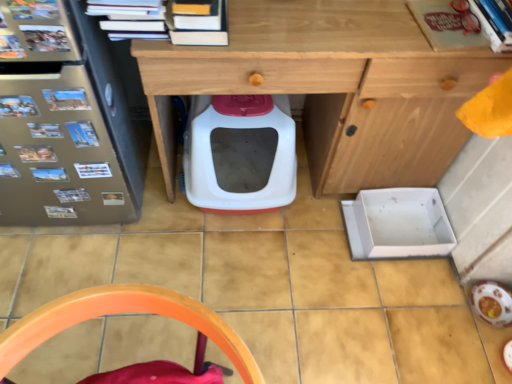
Question: From a real-world perspective, is matte red book at upper right, which is the 2th book from right to left, beneath wooden desk at center?

Choices:
 (A) no
 (B) yes

Answer: (A)

Question: Is matte red book at upper right, which is the 2th book from right to left, further to camera compared to wooden desk at center?

Choices:
 (A) no
 (B) yes

Answer: (B)

Question: From the image's perspective, does matte red book at upper right, which appears as the 2th book when viewed from the left, appear lower than wooden desk at center?

Choices:
 (A) no
 (B) yes

Answer: (A)

Question: Can you confirm if matte red book at upper right, which is the 2th book from right to left, is bigger than wooden desk at center?

Choices:
 (A) yes
 (B) no

Answer: (B)

Question: From a real-world perspective, is matte red book at upper right, which is the 2th book from right to left, on wooden desk at center?

Choices:
 (A) no
 (B) yes

Answer: (B)

Question: In terms of width, does hardcover book at upper right, the 1th book viewed from the right, look wider or thinner when compared to matte red book at upper right, which appears as the 2th book when viewed from the left?

Choices:
 (A) wide
 (B) thin

Answer: (A)

Question: From a real-world perspective, is hardcover book at upper right, the 1th book viewed from the right, positioned above or below matte red book at upper right, which appears as the 2th book when viewed from the left?

Choices:
 (A) above
 (B) below

Answer: (A)

Question: Considering the positions of hardcover book at upper right, the 1th book viewed from the right, and matte red book at upper right, which appears as the 2th book when viewed from the left, in the image, is hardcover book at upper right, the 1th book viewed from the right, bigger or smaller than matte red book at upper right, which appears as the 2th book when viewed from the left,?

Choices:
 (A) small
 (B) big

Answer: (B)

Question: Would you say hardcover book at upper right, which is the 3th book from left to right, is to the left or to the right of matte red book at upper right, which is the 2th book from right to left, in the picture?

Choices:
 (A) left
 (B) right

Answer: (B)

Question: Is white plastic litter box at center wider or thinner than orange plastic chair at lower center?

Choices:
 (A) wide
 (B) thin

Answer: (A)

Question: Is white plastic litter box at center inside or outside of orange plastic chair at lower center?

Choices:
 (A) outside
 (B) inside

Answer: (A)

Question: Looking at the image, does white plastic litter box at center seem bigger or smaller compared to orange plastic chair at lower center?

Choices:
 (A) small
 (B) big

Answer: (A)

Question: Would you say white plastic litter box at center is to the left or to the right of orange plastic chair at lower center in the picture?

Choices:
 (A) right
 (B) left

Answer: (A)

Question: Is point (254, 119) positioned closer to the camera than point (133, 1)?

Choices:
 (A) farther
 (B) closer

Answer: (A)

Question: From a real-world perspective, relative to hardcover books at upper center, the third book when ordered from right to left, is white plastic litter box at center vertically above or below?

Choices:
 (A) below
 (B) above

Answer: (A)